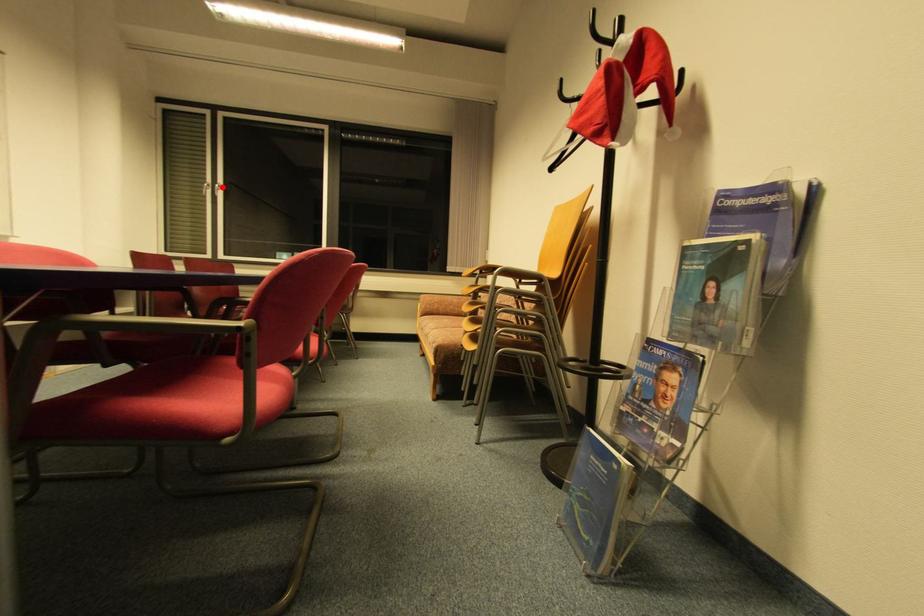
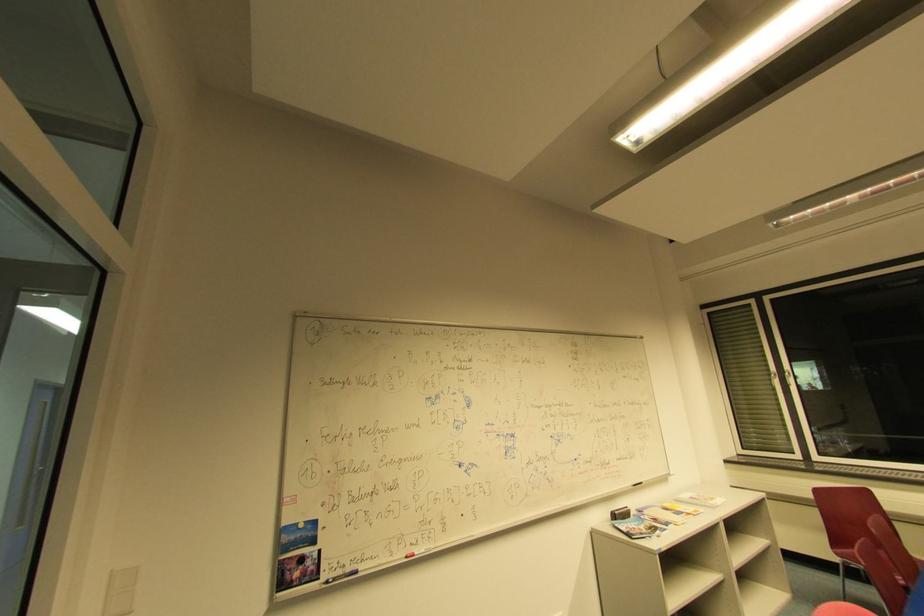
The point at the highlighted location is marked in the first image. Where is the corresponding point in the second image?

(791, 375)